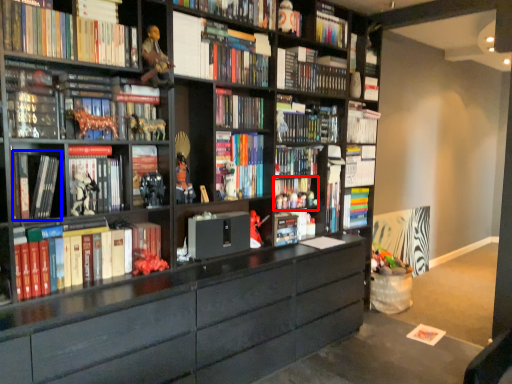
Question: Which object appears farthest to the camera in this image, book (highlighted by a red box) or book (highlighted by a blue box)?

Choices:
 (A) book
 (B) book

Answer: (A)